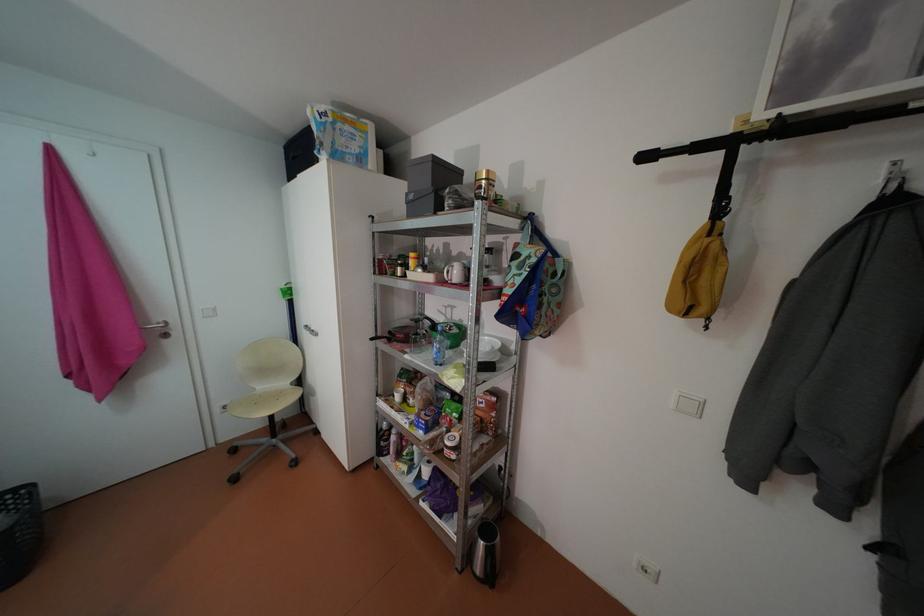
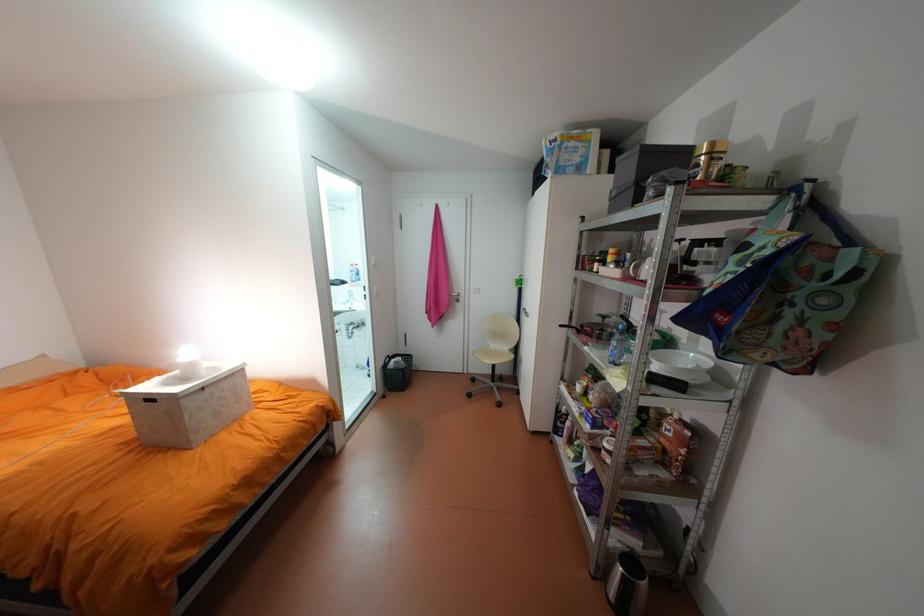
The point at (269, 400) is marked in the first image. Where is the corresponding point in the second image?

(497, 352)